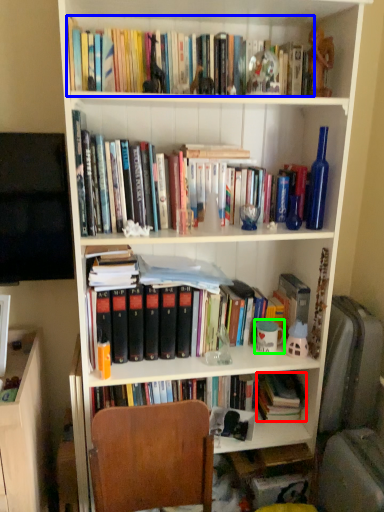
Question: Estimate the real-world distances between objects in this image. Which object is closer to book (highlighted by a red box), book (highlighted by a blue box) or coffee cup (highlighted by a green box)?

Choices:
 (A) book
 (B) coffee cup

Answer: (B)